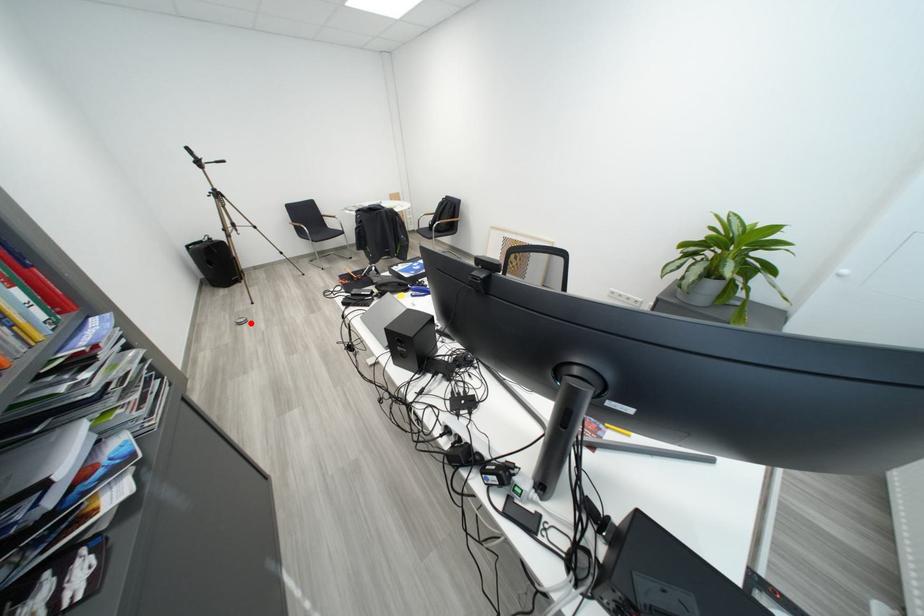
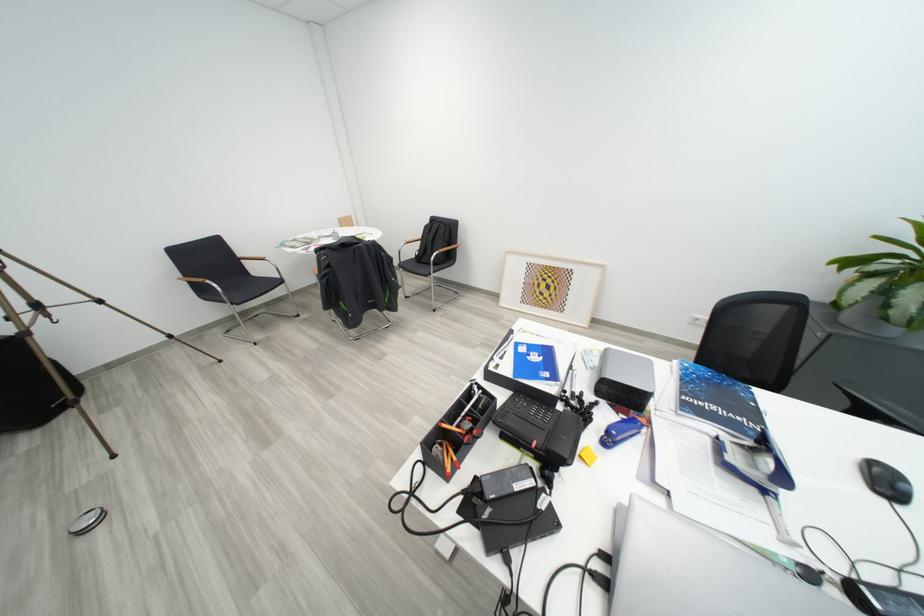
Question: I am providing you with two images of the same scene from different viewpoints. A red point is marked on the first image. At the location where the point appears in image 1, is it still visible in image 2?

Choices:
 (A) Yes
 (B) No

Answer: (A)